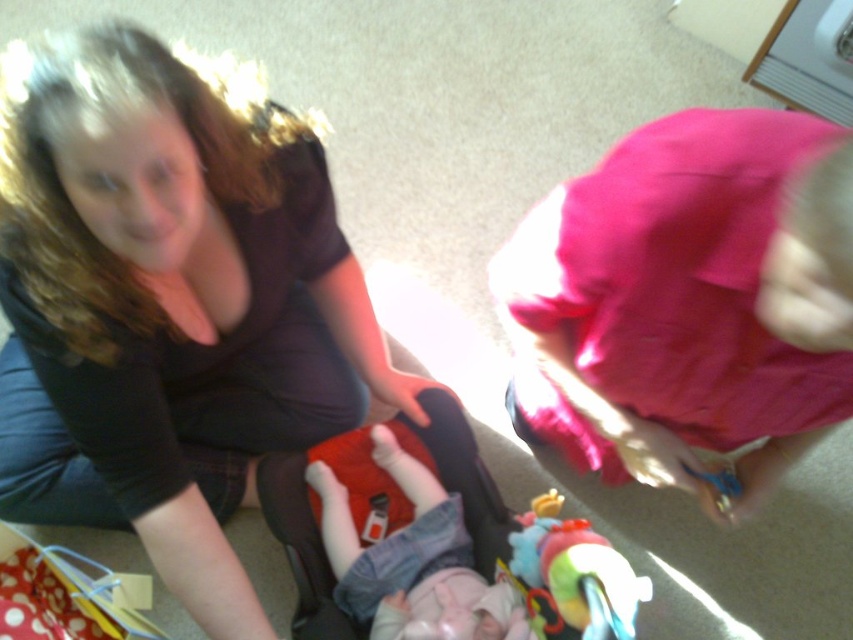
Question: Does pink fabric at upper right have a smaller size compared to denim pants at center?

Choices:
 (A) yes
 (B) no

Answer: (B)

Question: Which is nearer to the denim pants at center?

Choices:
 (A) rubberized plastic toy at lower center
 (B) matte black shirt at center
 (C) pink fabric at upper right

Answer: (A)

Question: Which object is the closest to the denim pants at center?

Choices:
 (A) matte black shirt at center
 (B) pink fabric at upper right
 (C) rubberized plastic toy at lower center

Answer: (C)

Question: Does matte black shirt at center appear over rubberized plastic toy at lower center?

Choices:
 (A) no
 (B) yes

Answer: (B)

Question: From the image, what is the correct spatial relationship of matte black shirt at center in relation to rubberized plastic toy at lower center?

Choices:
 (A) below
 (B) above

Answer: (B)

Question: Which object is closer to the camera taking this photo?

Choices:
 (A) denim pants at center
 (B) rubberized plastic toy at lower center

Answer: (B)